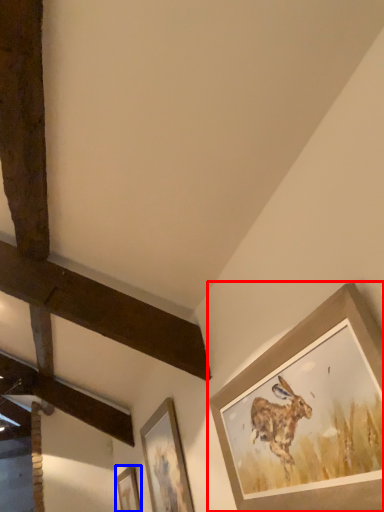
Question: Among these objects, which one is farthest to the camera, picture frame (highlighted by a red box) or picture frame (highlighted by a blue box)?

Choices:
 (A) picture frame
 (B) picture frame

Answer: (B)